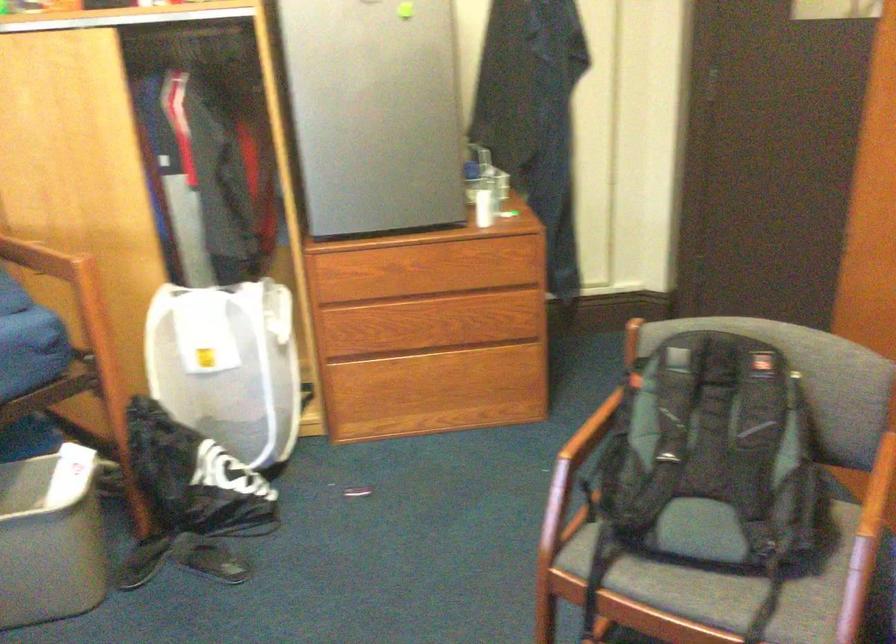
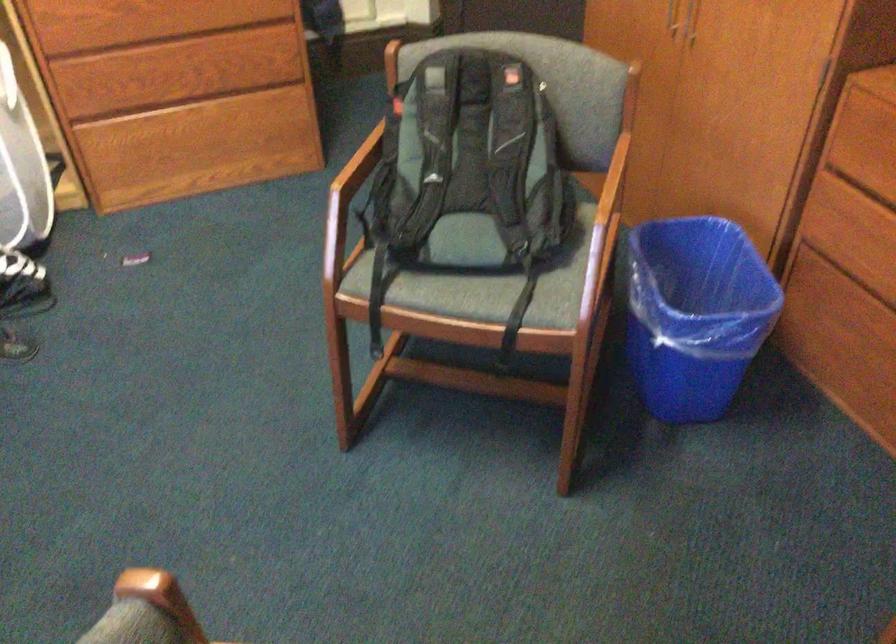
Find the pixel in the second image that matches point 405,339 in the first image.

(159, 91)